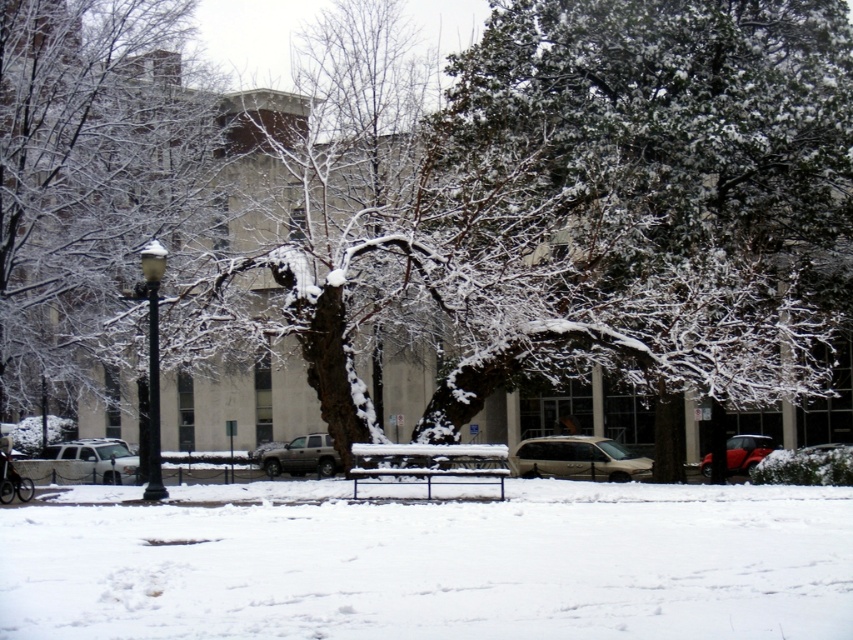
Which is behind, point (578, 451) or point (51, 477)?

Positioned behind is point (51, 477).

Does point (541, 442) come in front of point (119, 476)?

That is True.

The image size is (853, 640). Find the location of `metallic silver suv at center`. metallic silver suv at center is located at coordinates (577, 458).

Is white fluffy snow at center further to the viewer compared to silver metallic suv at center?

No, white fluffy snow at center is in front of silver metallic suv at center.

Between white fluffy snow at center and silver metallic suv at center, which one is positioned lower?

silver metallic suv at center is below.

Measure the distance between white fluffy snow at center and camera.

6.35 meters

I want to click on white fluffy snow at center, so click(x=440, y=564).

Between black polished metal lamp post at left and white matte suv at lower left, which one is positioned lower?

white matte suv at lower left is below.

Where is `black polished metal lamp post at left`? The image size is (853, 640). black polished metal lamp post at left is located at coordinates (152, 362).